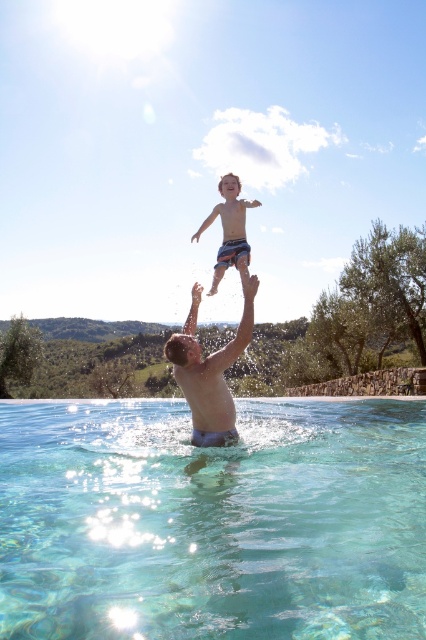
Question: Which object appears farthest from the camera in this image?

Choices:
 (A) smooth skin man at center
 (B) blue striped shorts at upper center
 (C) clear glass water at lower center

Answer: (B)

Question: Does smooth skin man at center appear on the right side of blue striped shorts at upper center?

Choices:
 (A) yes
 (B) no

Answer: (B)

Question: In this image, where is smooth skin man at center located relative to blue striped shorts at upper center?

Choices:
 (A) above
 (B) below

Answer: (B)

Question: Among these points, which one is farthest from the camera?

Choices:
 (A) (345, 401)
 (B) (247, 252)
 (C) (226, 424)

Answer: (A)

Question: Is smooth skin man at center above blue striped shorts at upper center?

Choices:
 (A) no
 (B) yes

Answer: (A)

Question: Estimate the real-world distances between objects in this image. Which object is farther from the blue striped shorts at upper center?

Choices:
 (A) smooth skin man at center
 (B) clear glass water at lower center

Answer: (B)